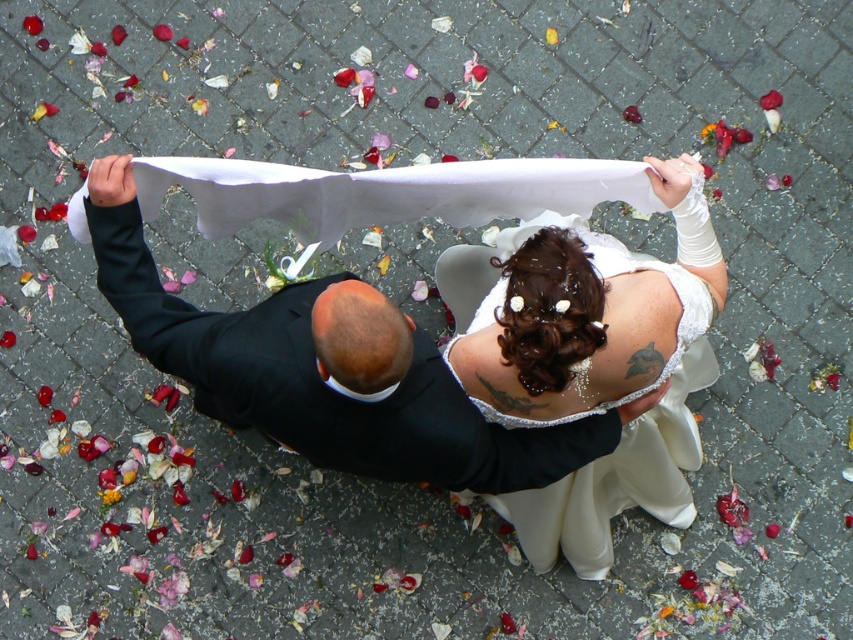
Is point (572, 532) positioned behind point (410, 394)?

Yes.

Where is `white lace dress at center`? The width and height of the screenshot is (853, 640). white lace dress at center is located at coordinates (590, 360).